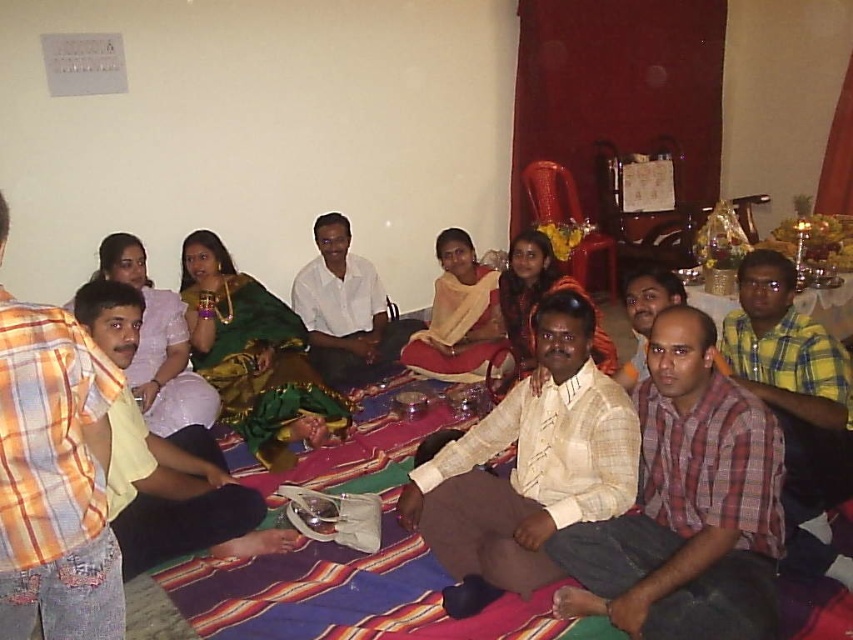
You are standing in the room and see both the light beige textured shirt at center and the white cotton shirt at center. Which shirt is nearer to you?

The light beige textured shirt at center is closer to the viewer than the white cotton shirt at center.

You are a photographer standing at the back of the room. You want to take a photo that includes both the light beige textured shirt at center and the white cotton shirt at center. What is the minimum distance you need to move forward to ensure both shirts are in frame?

The light beige textured shirt at center and white cotton shirt at center are 1.71 meters apart from each other. To capture both in the frame, you need to move forward until your camera can encompass a 1.71 meter width within the shot. The exact distance depends on your camera lens, but ensuring the shirts are within the field of view requires positioning yourself close enough to cover their separation distance.

Where is the white cotton shirt at center located in the image?

The white cotton shirt at center is located at point coordinates of approximately 0.486 on the x axis and 0.406 on the y axis.